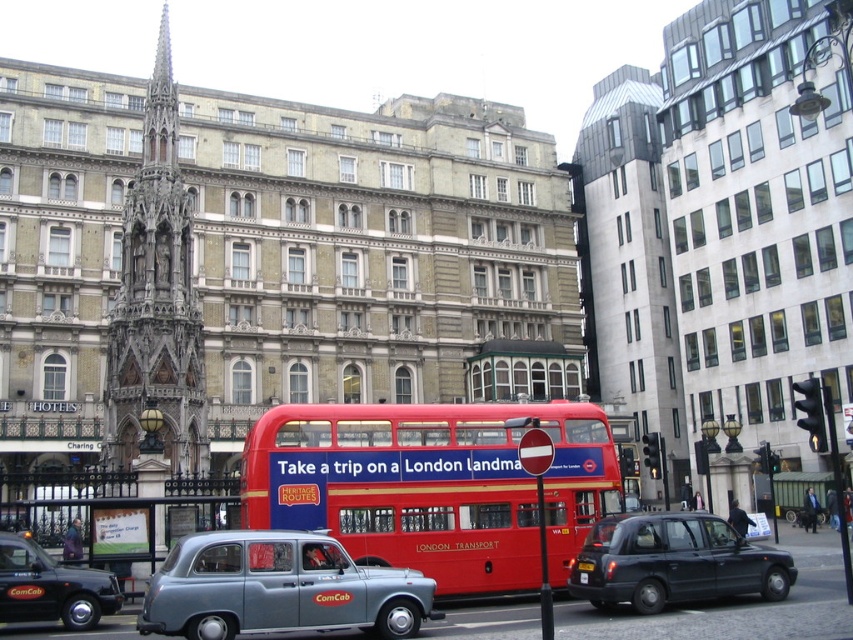
Question: Is black rubber taxi at lower right further to camera compared to black plastic license plate at center?

Choices:
 (A) no
 (B) yes

Answer: (A)

Question: In this image, where is black matte taxi at lower left located relative to black plastic license plate at center?

Choices:
 (A) right
 (B) left

Answer: (B)

Question: Which point is closer to the camera?

Choices:
 (A) yellow plastic license plate at center
 (B) metallic gray taxi at center
 (C) black matte taxi at lower left

Answer: (B)

Question: Is black rubber taxi at lower right bigger than black matte taxi at lower left?

Choices:
 (A) yes
 (B) no

Answer: (A)

Question: Which point is closer to the camera?

Choices:
 (A) pyautogui.click(x=258, y=609)
 (B) pyautogui.click(x=674, y=540)

Answer: (A)

Question: Based on their relative distances, which object is farther from the metallic gray taxi at center?

Choices:
 (A) red matte double-decker bus at center
 (B) black rubber taxi at lower right
 (C) black matte taxi at lower left

Answer: (B)